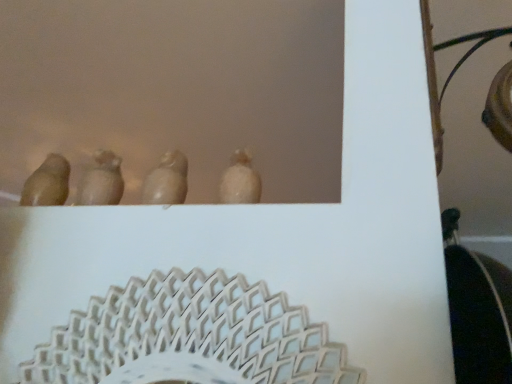
Question: Is matte brown bird at center, which is the second animal from right to left, shorter than matte white bird at center, arranged as the second animal when viewed from the left?

Choices:
 (A) yes
 (B) no

Answer: (A)

Question: From the image's perspective, is matte brown bird at center, acting as the 1th animal starting from the left, under matte white bird at center, acting as the 1th animal starting from the right?

Choices:
 (A) no
 (B) yes

Answer: (B)

Question: Can you confirm if matte brown bird at center, acting as the 1th animal starting from the left, is wider than matte white bird at center, acting as the 1th animal starting from the right?

Choices:
 (A) yes
 (B) no

Answer: (A)

Question: Is matte brown bird at center, which is the second animal from right to left, outside matte white bird at center, arranged as the second animal when viewed from the left?

Choices:
 (A) yes
 (B) no

Answer: (A)

Question: Is matte white bird at center, arranged as the second animal when viewed from the left, surrounded by matte brown bird at center, which is the second animal from right to left?

Choices:
 (A) no
 (B) yes

Answer: (A)

Question: Is matte brown bird at center, acting as the 1th animal starting from the left, in contact with matte white bird at center, acting as the 1th animal starting from the right?

Choices:
 (A) yes
 (B) no

Answer: (B)

Question: From a real-world perspective, is matte white bird at center, acting as the 1th animal starting from the right, positioned under matte brown bird at center, which is the second animal from right to left, based on gravity?

Choices:
 (A) yes
 (B) no

Answer: (B)

Question: Can you confirm if matte white bird at center, acting as the 1th animal starting from the right, is thinner than matte brown bird at center, acting as the 1th animal starting from the left?

Choices:
 (A) yes
 (B) no

Answer: (A)

Question: From a real-world perspective, is matte white bird at center, arranged as the second animal when viewed from the left, on matte brown bird at center, which is the second animal from right to left?

Choices:
 (A) yes
 (B) no

Answer: (A)

Question: Is matte white bird at center, arranged as the second animal when viewed from the left, at the right side of matte brown bird at center, acting as the 1th animal starting from the left?

Choices:
 (A) no
 (B) yes

Answer: (B)

Question: Is matte white bird at center, acting as the 1th animal starting from the right, next to matte brown bird at center, acting as the 1th animal starting from the left?

Choices:
 (A) no
 (B) yes

Answer: (A)

Question: From the image's perspective, does matte white bird at center, arranged as the second animal when viewed from the left, appear lower than matte brown bird at center, which is the second animal from right to left?

Choices:
 (A) yes
 (B) no

Answer: (B)

Question: From the image's perspective, is matte white bird at center, acting as the 1th animal starting from the right, positioned above or below matte brown bird at center, which is the second animal from right to left?

Choices:
 (A) below
 (B) above

Answer: (B)